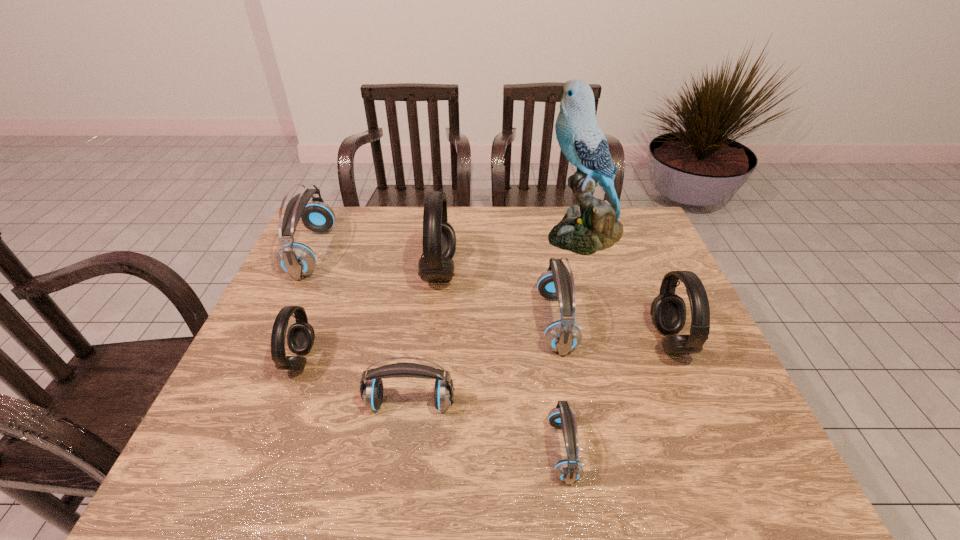
Find the location of a particular element. object at the near edge is located at coordinates (569, 470).

The width and height of the screenshot is (960, 540). What are the coordinates of `parakeet positioned at the right edge` in the screenshot? It's located at (596, 227).

Where is `headset that is positioned at the right edge`? This screenshot has width=960, height=540. headset that is positioned at the right edge is located at coordinates click(668, 310).

Identify the location of object present at the far left corner. (298, 260).

At what (x,y) coordinates should I click in order to perform the action: click on object that is positioned at the far right corner. Please return your answer as a coordinate pair (x, y). The height and width of the screenshot is (540, 960). Looking at the image, I should click on (596, 227).

At what (x,y) coordinates should I click in order to perform the action: click on vacant area at the far edge. Please return your answer as a coordinate pair (x, y). The image size is (960, 540). Looking at the image, I should click on (379, 210).

What are the coordinates of `vacant space at the near edge` in the screenshot? It's located at (313, 476).

Where is `vacant space at the left edge of the desktop`? vacant space at the left edge of the desktop is located at coordinates (248, 408).

Locate an element on the screen. Image resolution: width=960 pixels, height=540 pixels. vacant space at the right edge of the desktop is located at coordinates (704, 350).

This screenshot has width=960, height=540. What are the coordinates of `free location at the far left corner of the desktop` in the screenshot? It's located at (345, 241).